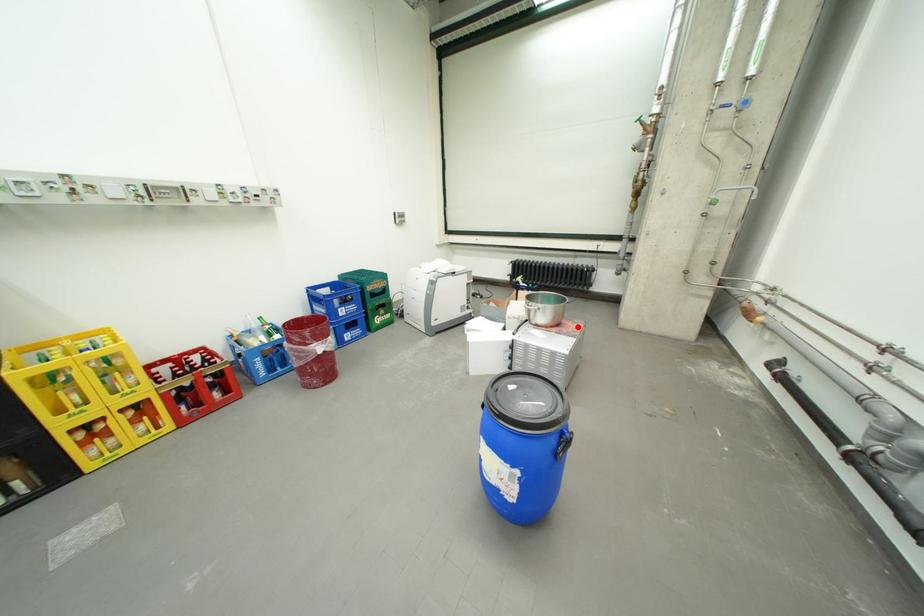
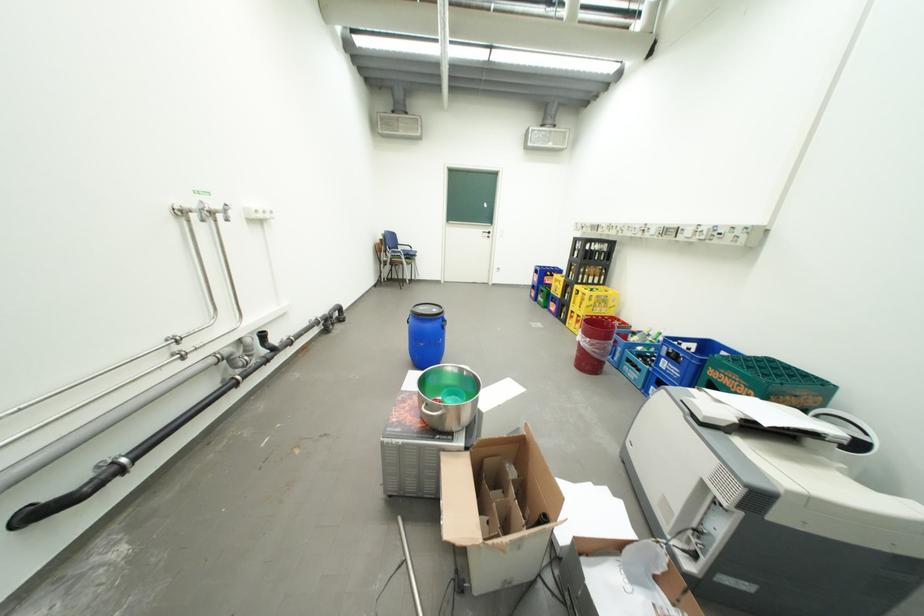
Question: I am providing you with two images of the same scene from different viewpoints. Image1 has a red point marked. In image2, the corresponding 3D location appears at what relative position? Reply with the corresponding letter.

Choices:
 (A) Closer
 (B) Farther

Answer: (B)